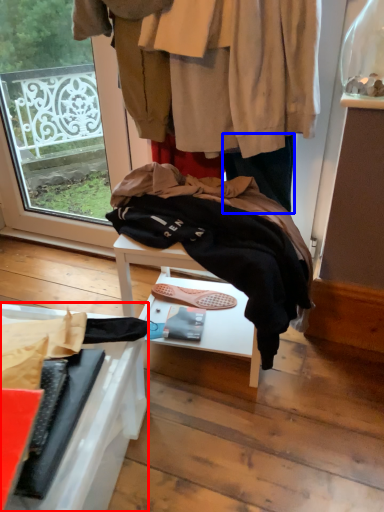
Question: Which point is further to the camera, furniture (highlighted by a red box) or trousers (highlighted by a blue box)?

Choices:
 (A) furniture
 (B) trousers

Answer: (B)